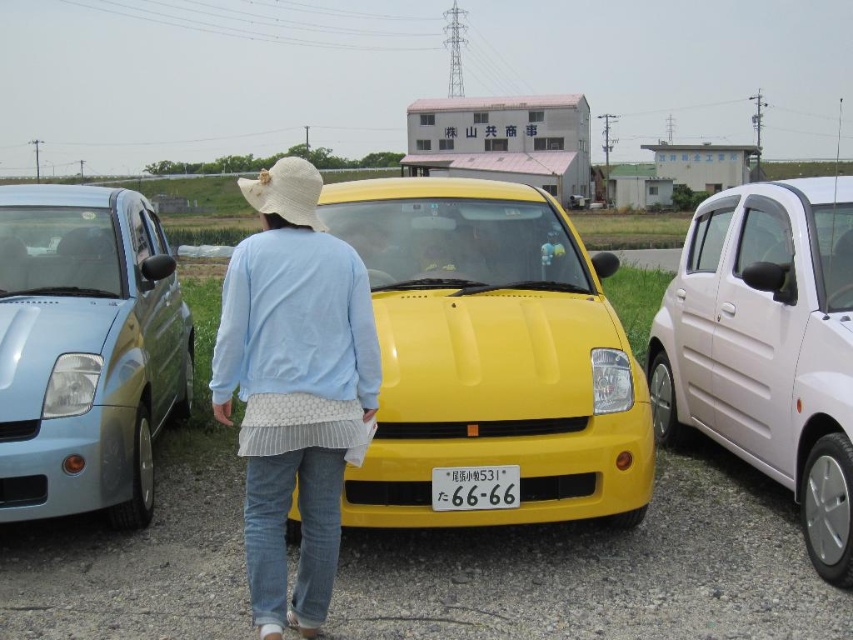
You are standing in the middle of a rural road and see a person walking towards a yellow car. They are wearing a white straw hat at center and have a white plastic license plate at center on their clothing. Which object is higher up?

The white straw hat at center is above the white plastic license plate at center.

You are a photographer trying to capture the matte metallic car at left and the light blue fabric at center in the same frame. Based on their heights, which object should you focus on first to ensure both are in the frame?

The matte metallic car at left is taller than the light blue fabric at center, so you should focus on the matte metallic car at left first to ensure both are in the frame.